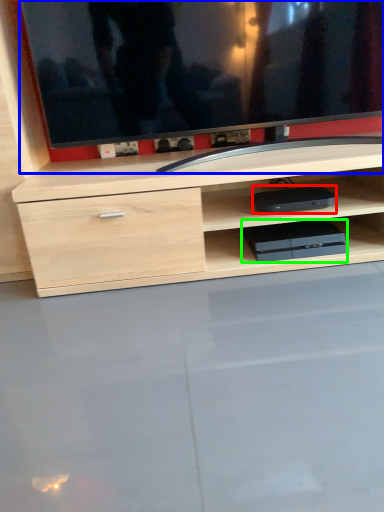
Question: Which object is positioned closest to equipment (highlighted by a red box)? Select from television (highlighted by a blue box) and equipment (highlighted by a green box).

Choices:
 (A) television
 (B) equipment

Answer: (B)